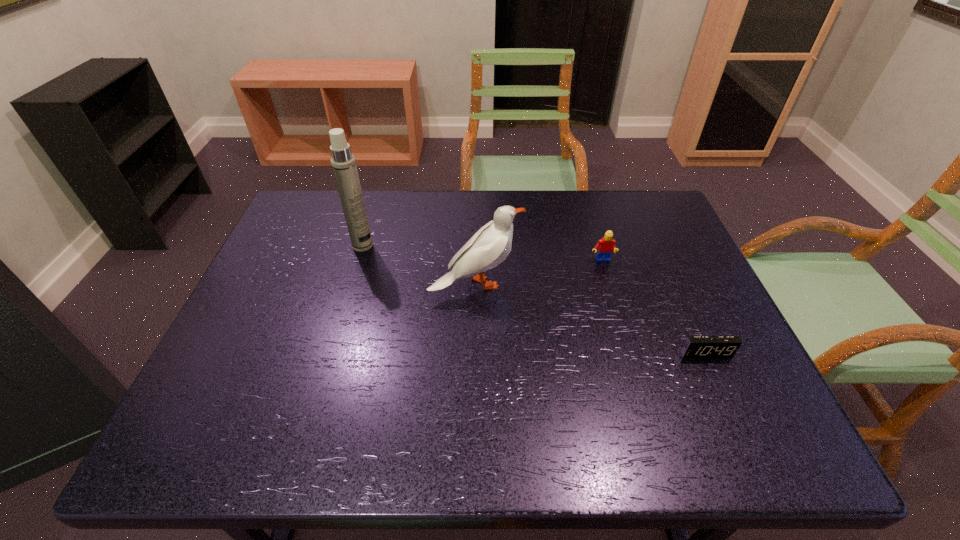
The width and height of the screenshot is (960, 540). In order to click on empty location between the alarm clock and the gull in this screenshot , I will do `click(590, 319)`.

You are a GUI agent. You are given a task and a screenshot of the screen. Output one action in this format:
    pyautogui.click(x=<x>, y=<y>)
    Task: Click on the vacant point located between the third object from left to right and the gull
    The width and height of the screenshot is (960, 540).
    Given the screenshot: What is the action you would take?
    pyautogui.click(x=539, y=272)

Where is `vacant point located between the second nearest object and the second farthest object`? Image resolution: width=960 pixels, height=540 pixels. vacant point located between the second nearest object and the second farthest object is located at coordinates (539, 272).

Locate an element on the screen. Image resolution: width=960 pixels, height=540 pixels. vacant area that lies between the Lego and the third farthest object is located at coordinates (539, 272).

Locate an element on the screen. This screenshot has width=960, height=540. unoccupied position between the nearest object and the third object from right to left is located at coordinates (590, 319).

Find the location of a particular element. free spot between the nearest object and the aerosol can is located at coordinates (534, 299).

The width and height of the screenshot is (960, 540). Find the location of `free space between the farthest object and the second object from left to right`. free space between the farthest object and the second object from left to right is located at coordinates (420, 265).

I want to click on the second closest object to the second object from right to left, so click(695, 346).

Locate which object is the closest to the second shortest object. Please provide its 2D coordinates. Your answer should be formatted as a tuple, i.e. [(x, y)], where the tuple contains the x and y coordinates of a point satisfying the conditions above.

[(490, 245)]

Find the location of a particular element. This screenshot has width=960, height=540. vacant space that satisfies the following two spatial constraints: 1. on the front-facing side of the third nearest object; 2. at the beak of the gull is located at coordinates (609, 284).